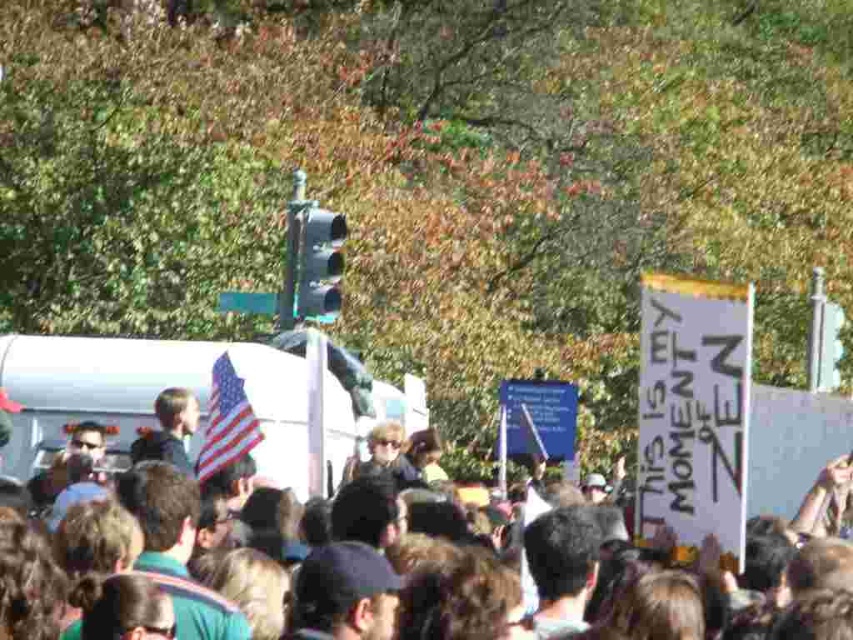
You are part of the crowd holding the white paper sign at center and the american flag at center. Which object is closer to you?

The white paper sign at center is closer to you because the american flag at center is behind it.

You are organizing a protest and need to ensure visibility of your signs. Given that the white paper sign at center and the american flag at center are both in the crowd, which one is wider and thus more visible from a distance?

The white paper sign at center is wider than the american flag at center, making it more visible from a distance.